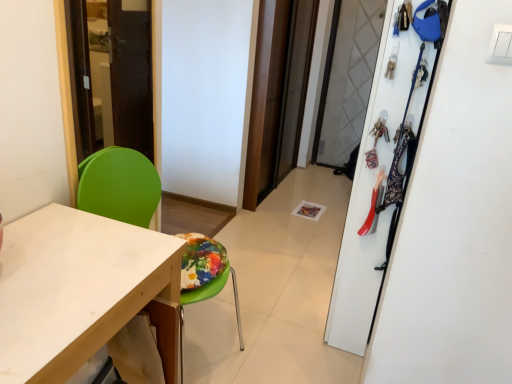
This screenshot has width=512, height=384. I want to click on vacant space in front of transparent glass screen door at center, so click(x=286, y=220).